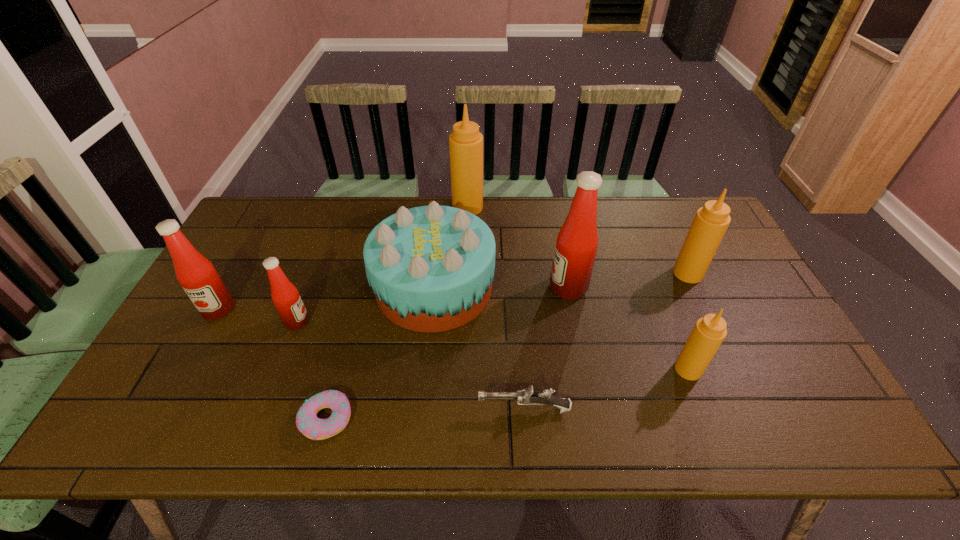
Where is `free space that satisfies the following two spatial constraints: 1. on the front side of the rightmost condiment; 2. aimed along the barrel of the eighth tallest object`? This screenshot has width=960, height=540. free space that satisfies the following two spatial constraints: 1. on the front side of the rightmost condiment; 2. aimed along the barrel of the eighth tallest object is located at coordinates (753, 409).

This screenshot has width=960, height=540. In order to click on vacant space that satisfies the following two spatial constraints: 1. on the front-facing side of the doughnut; 2. on the left side of the eighth object from right to left in this screenshot , I will do `click(261, 418)`.

Where is `free location that satisfies the following two spatial constraints: 1. on the back side of the second tan condiment from right to left; 2. on the left side of the doughnut`? free location that satisfies the following two spatial constraints: 1. on the back side of the second tan condiment from right to left; 2. on the left side of the doughnut is located at coordinates (339, 369).

Identify the location of free space that satisfies the following two spatial constraints: 1. on the front-facing side of the second object from left to right; 2. on the back side of the second tan condiment from left to right. This screenshot has width=960, height=540. (279, 369).